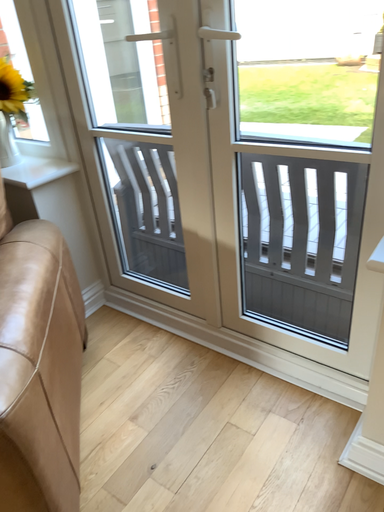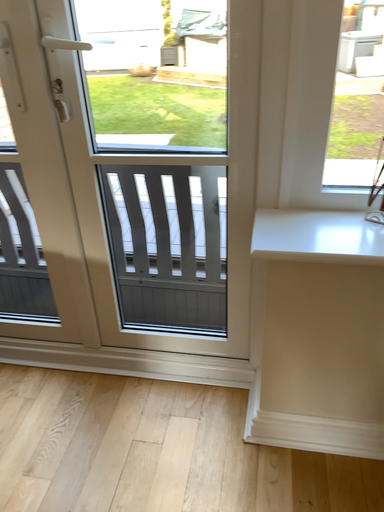
Question: Which way did the camera rotate in the video?

Choices:
 (A) rotated right
 (B) rotated left

Answer: (A)